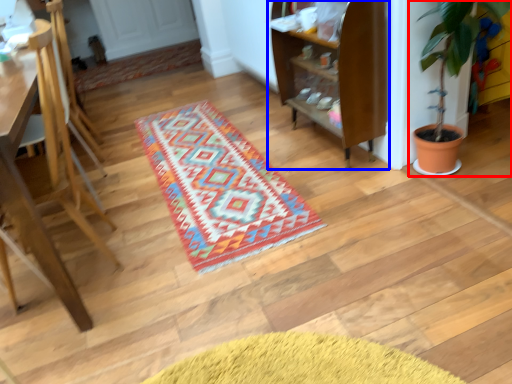
Question: Which object appears closest to the camera in this image, houseplant (highlighted by a red box) or shelf (highlighted by a blue box)?

Choices:
 (A) houseplant
 (B) shelf

Answer: (A)